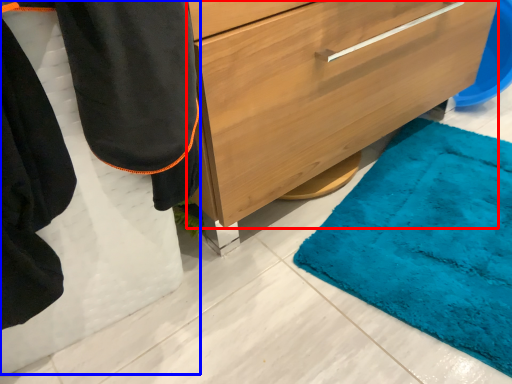
Question: Which object is further to the camera taking this photo, chest of drawers (highlighted by a red box) or robe (highlighted by a blue box)?

Choices:
 (A) chest of drawers
 (B) robe

Answer: (A)